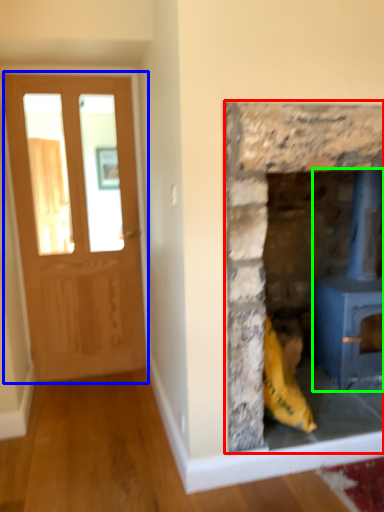
Question: Which is nearer to the fireplace (highlighted by a red box)? glass door (highlighted by a blue box) or wood burning stove (highlighted by a green box).

Choices:
 (A) glass door
 (B) wood burning stove

Answer: (B)